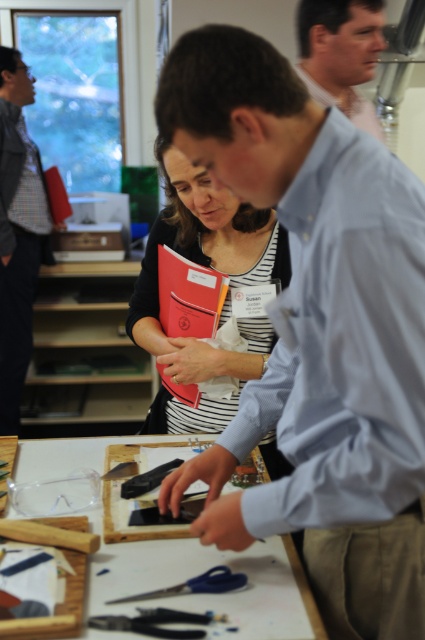
How far apart are orange matte folder at center and blue plastic scissors at lower center?

25.21 inches

Who is shorter, orange matte folder at center or blue plastic scissors at lower center?

With less height is blue plastic scissors at lower center.

Who is more distant from viewer, (198, 316) or (144, 595)?

The point (198, 316) is more distant.

Identify the location of orange matte folder at center. (189, 296).

Does point (277, 632) come behind point (28, 248)?

That is False.

Is white paperboard at center behind matte black shirt at left?

No.

Between point (266, 620) and point (30, 301), which one is positioned in front?

Point (266, 620) is more forward.

The width and height of the screenshot is (425, 640). Find the location of `white paperboard at center`. white paperboard at center is located at coordinates (212, 595).

Can you confirm if matte black folder at center is thinner than matte black shirt at left?

No, matte black folder at center is not thinner than matte black shirt at left.

Between point (144, 317) and point (28, 228), which one is positioned in front?

Point (144, 317)

Which is in front, point (255, 260) or point (0, 214)?

Point (255, 260) is in front.

Identify the location of matte black folder at center. (209, 266).